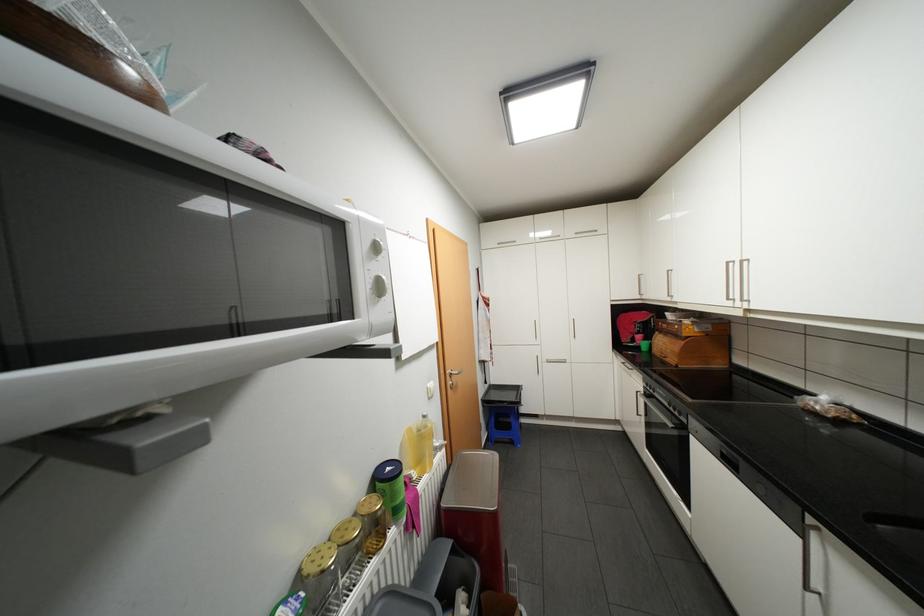
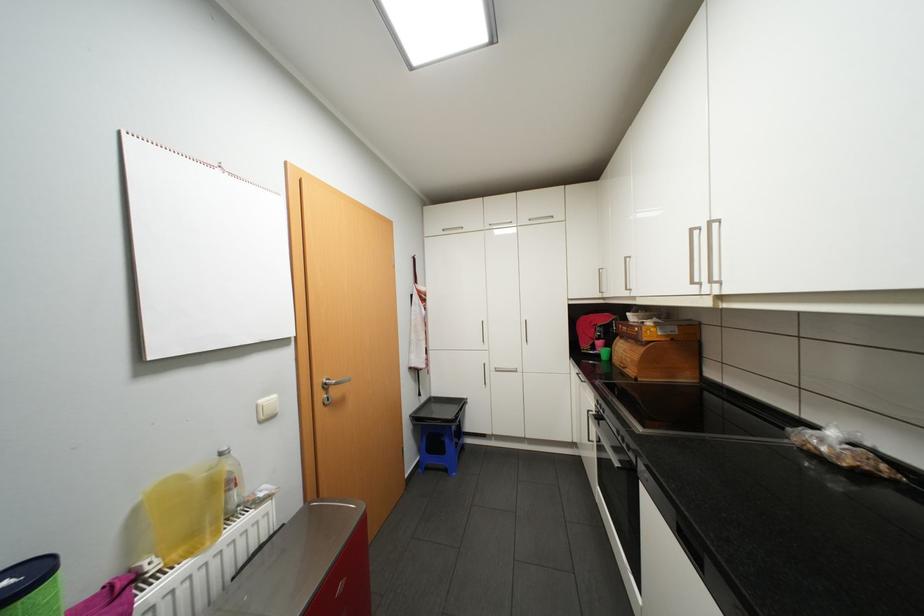
Question: How did the camera likely rotate?

Choices:
 (A) Left
 (B) Right
 (C) Up
 (D) Down

Answer: (B)